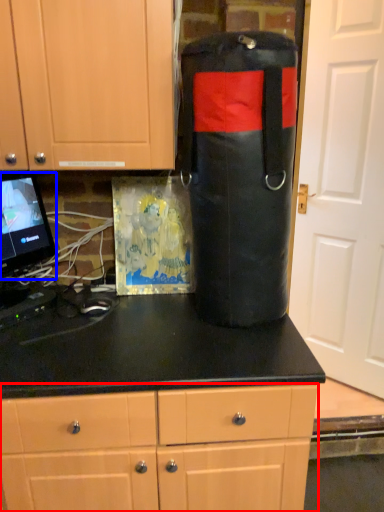
Question: Which of the following is the farthest to the observer, cabinetry (highlighted by a red box) or computer monitor (highlighted by a blue box)?

Choices:
 (A) cabinetry
 (B) computer monitor

Answer: (B)